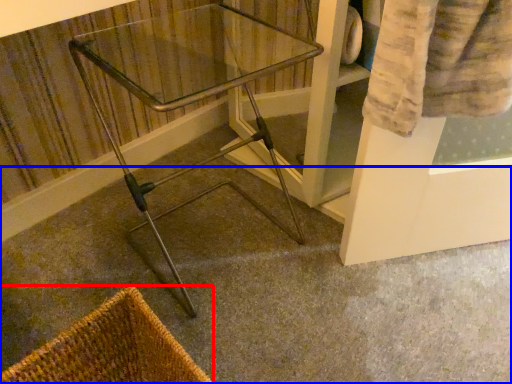
Question: Among these objects, which one is nearest to the camera, basket (highlighted by a red box) or concrete (highlighted by a blue box)?

Choices:
 (A) basket
 (B) concrete

Answer: (A)